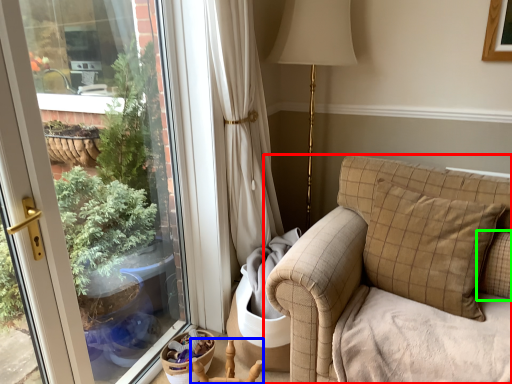
Question: Considering the real-world distances, which object is closest to studio couch (highlighted by a red box)? armchair (highlighted by a blue box) or pillow (highlighted by a green box).

Choices:
 (A) armchair
 (B) pillow

Answer: (B)